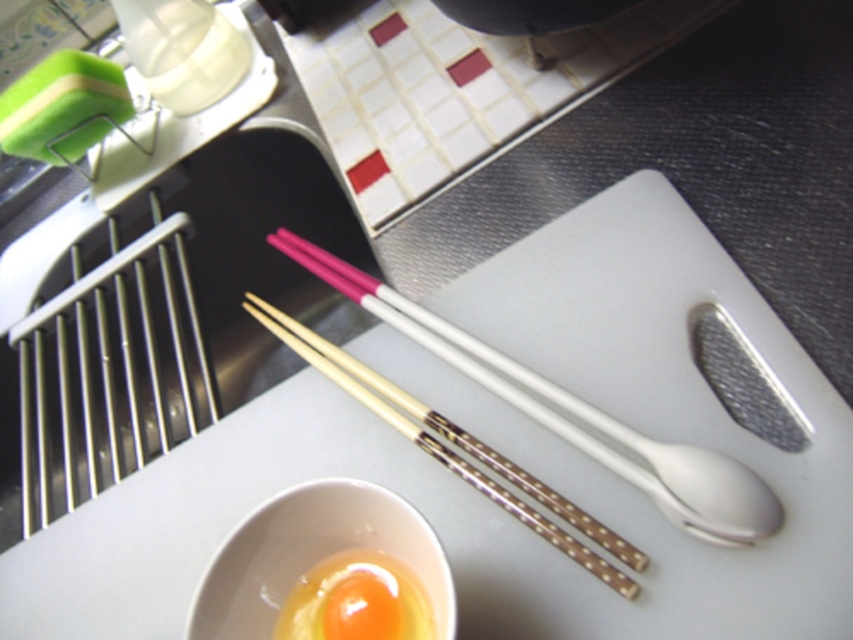
You are a chef preparing a dish and need to choose between the white plastic spoon at center and the wooden chopsticks at center. Which utensil is taller?

The white plastic spoon at center is taller than the wooden chopsticks at center.

You are preparing a recipe that requires measuring ingredients. You have a white plastic spoon at center and a white ceramic bowl at lower center. Which of these two items is larger in size?

The white plastic spoon at center is bigger than the white ceramic bowl at lower center.

You are preparing to cook an omelette and need to check the height of the wooden chopsticks at center and the smooth yellow egg at center. Which one is taller?

The wooden chopsticks at center are taller than the smooth yellow egg at center according to the description.